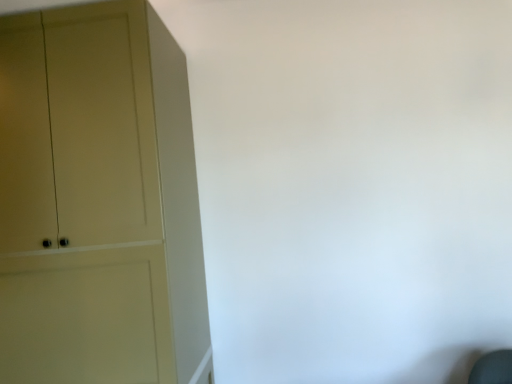
What do you see at coordinates (98, 201) in the screenshot?
I see `matte beige cupboard at left` at bounding box center [98, 201].

Locate an element on the screen. matte beige cupboard at left is located at coordinates (98, 201).

Identify the location of matte beige cupboard at left. This screenshot has height=384, width=512. (98, 201).